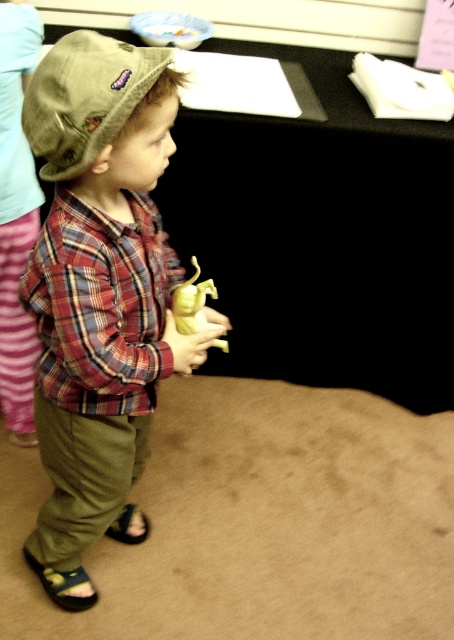
Question: Which of the following is the closest to the observer?

Choices:
 (A) tap(29, 262)
 (B) tap(74, 602)
 (C) tap(202, 188)

Answer: (A)

Question: Which point is closer to the camera?

Choices:
 (A) green fabric hat at upper left
 (B) green fabric pants at lower left
 (C) plaid cotton shirt at center

Answer: (A)

Question: Is green fabric pants at lower left smaller than plaid cotton shirt at center?

Choices:
 (A) yes
 (B) no

Answer: (B)

Question: Does plaid cotton shirt at center have a smaller size compared to matte yellow toy at center?

Choices:
 (A) yes
 (B) no

Answer: (B)

Question: Which point is closer to the camera taking this photo?

Choices:
 (A) (116, 93)
 (B) (156, 161)
 (C) (215, 312)
 (D) (399, 362)

Answer: (A)

Question: Is plaid fabric shirt at center to the right of green fabric hat at upper left from the viewer's perspective?

Choices:
 (A) no
 (B) yes

Answer: (B)